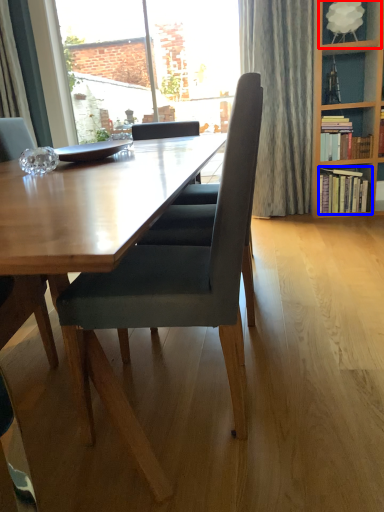
Question: Which of the following is the farthest to the observer, shelf (highlighted by a red box) or book (highlighted by a blue box)?

Choices:
 (A) shelf
 (B) book

Answer: (B)